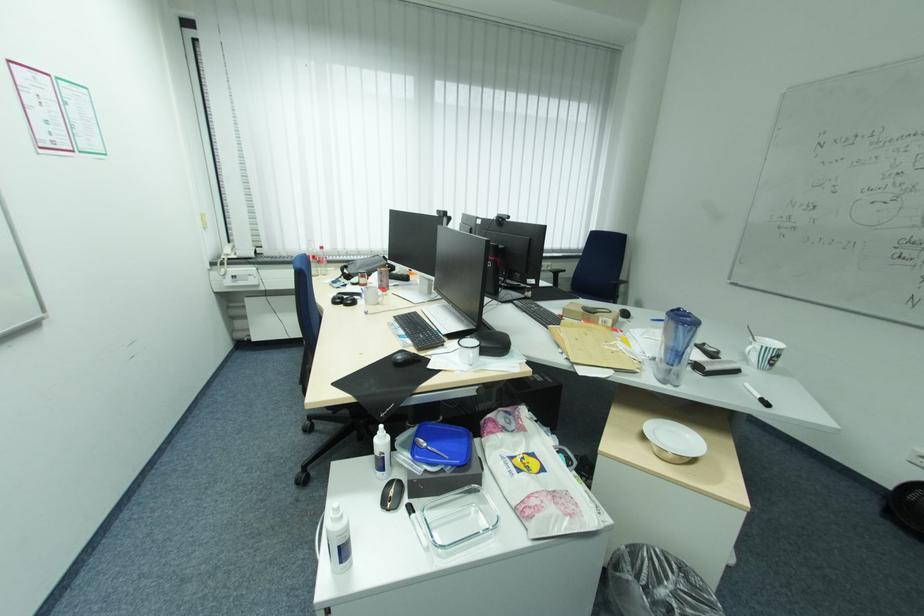
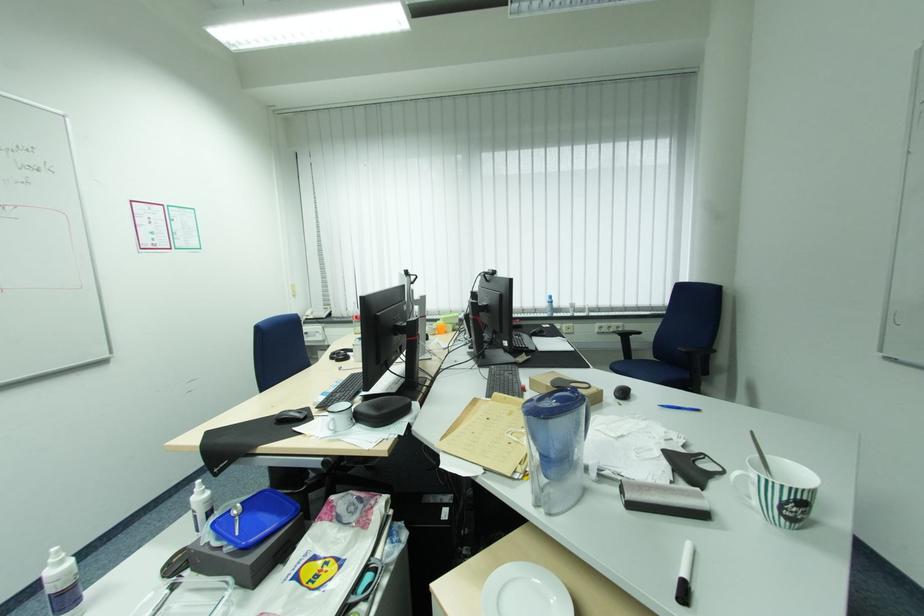
The point at (x=454, y=464) is marked in the first image. Where is the corresponding point in the second image?

(237, 543)